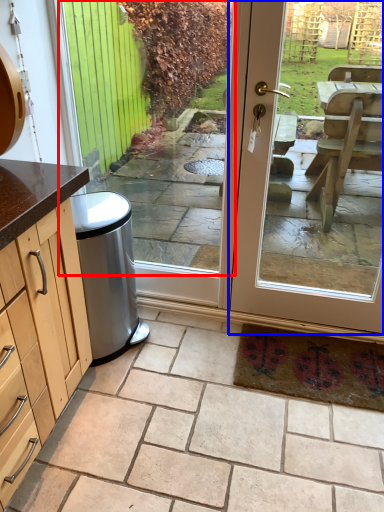
Question: Which object appears closest to the camera in this image, window (highlighted by a red box) or door (highlighted by a blue box)?

Choices:
 (A) window
 (B) door

Answer: (B)